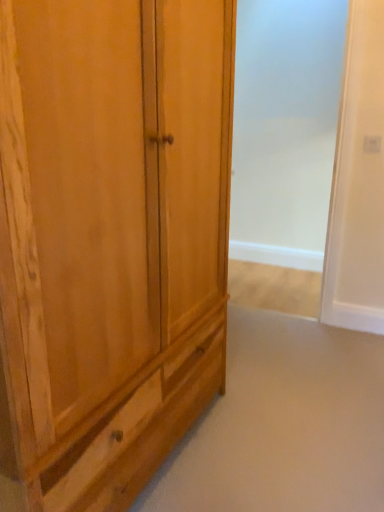
Question: Is natural wood cupboard at left wider or thinner than white glossy screen door at center?

Choices:
 (A) wide
 (B) thin

Answer: (A)

Question: Considering the positions of natural wood cupboard at left and white glossy screen door at center in the image, is natural wood cupboard at left taller or shorter than white glossy screen door at center?

Choices:
 (A) tall
 (B) short

Answer: (B)

Question: Considering the relative positions of natural wood cupboard at left and white glossy screen door at center in the image provided, is natural wood cupboard at left to the left or to the right of white glossy screen door at center?

Choices:
 (A) right
 (B) left

Answer: (B)

Question: In terms of size, does white glossy screen door at center appear bigger or smaller than natural wood cupboard at left?

Choices:
 (A) small
 (B) big

Answer: (A)

Question: In terms of width, does white glossy screen door at center look wider or thinner when compared to natural wood cupboard at left?

Choices:
 (A) wide
 (B) thin

Answer: (B)

Question: Choose the correct answer: Is white glossy screen door at center inside natural wood cupboard at left or outside it?

Choices:
 (A) inside
 (B) outside

Answer: (B)

Question: Is point (307, 114) positioned closer to the camera than point (41, 422)?

Choices:
 (A) farther
 (B) closer

Answer: (A)